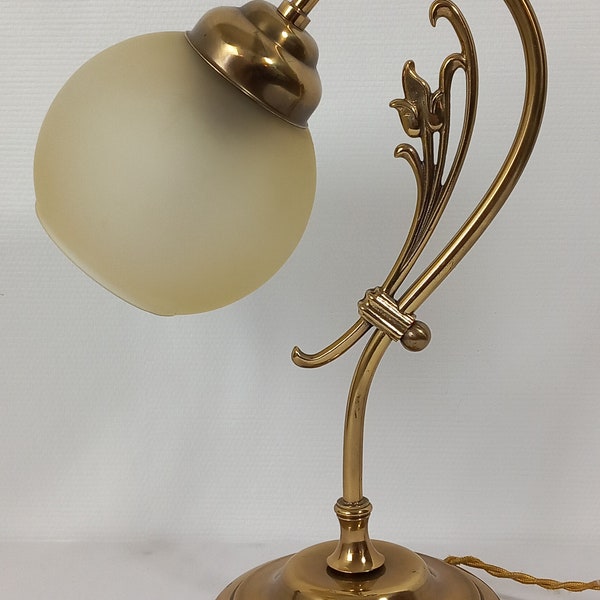
Where is `right of lamp`? The width and height of the screenshot is (600, 600). right of lamp is located at coordinates (547, 258).